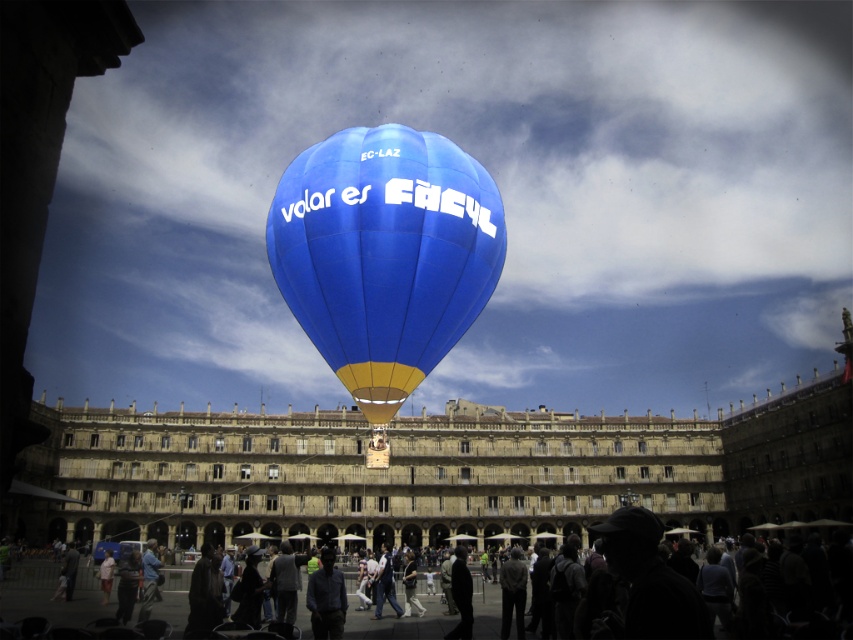
Question: Which point is farther to the camera?

Choices:
 (A) (314, 593)
 (B) (381, 550)

Answer: (B)

Question: Which object is closer to the camera taking this photo?

Choices:
 (A) dark gray fabric shirt at center
 (B) blue fabric balloon at center

Answer: (B)

Question: Considering the real-world distances, which object is closest to the dark blue jeans at center?

Choices:
 (A) dark gray fabric shirt at center
 (B) blue fabric balloon at center
 (C) silhouette clothing at lower center

Answer: (C)

Question: Can you confirm if blue fabric balloon at center is thinner than light brown fabric shirt at lower left?

Choices:
 (A) no
 (B) yes

Answer: (A)

Question: Is blue fabric balloon at center wider than dark blue jeans at center?

Choices:
 (A) no
 (B) yes

Answer: (B)

Question: Does blue fabric balloon at center appear over silhouette clothing at lower center?

Choices:
 (A) yes
 (B) no

Answer: (A)